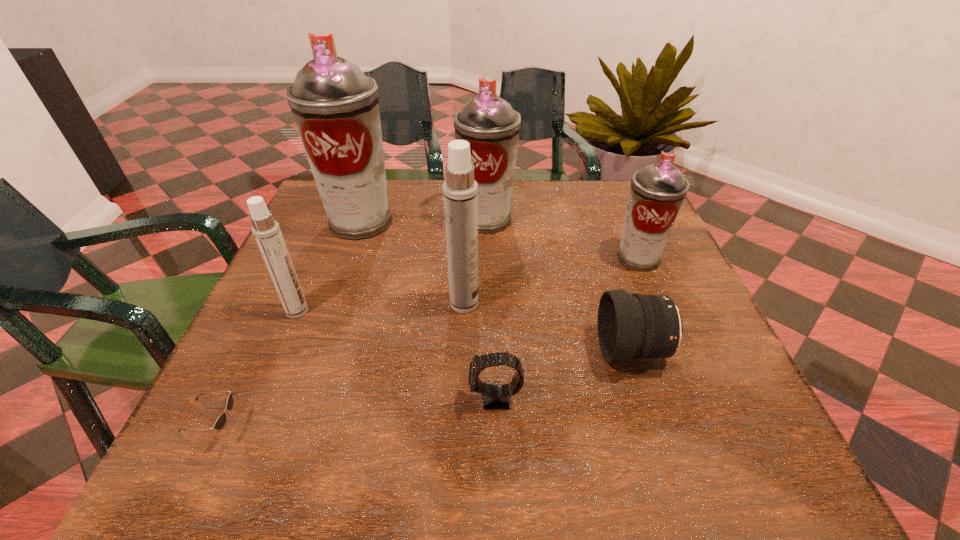
I want to click on gray watch, so click(496, 397).

Locate an element on the screen. The height and width of the screenshot is (540, 960). black sunglasses is located at coordinates (220, 422).

Image resolution: width=960 pixels, height=540 pixels. Identify the location of sunglasses. (220, 422).

Where is `free region located on the right of the biggest gray aerosol can`? This screenshot has height=540, width=960. free region located on the right of the biggest gray aerosol can is located at coordinates (488, 221).

Where is `vacant space located on the right of the second smallest gray aerosol can`? The height and width of the screenshot is (540, 960). vacant space located on the right of the second smallest gray aerosol can is located at coordinates (612, 219).

The height and width of the screenshot is (540, 960). I want to click on free space located 0.110m on the left of the right white aerosol can, so click(x=398, y=303).

Where is `free space located on the front of the smallest gray aerosol can`? The height and width of the screenshot is (540, 960). free space located on the front of the smallest gray aerosol can is located at coordinates (704, 415).

At what (x,y) coordinates should I click in order to perform the action: click on vacant position located 0.340m on the right of the smaller white aerosol can. Please return your answer as a coordinate pair (x, y). Looking at the image, I should click on (471, 311).

At what (x,y) coordinates should I click in order to perform the action: click on free space located 0.110m at the front element of the black telephoto lens. Please return your answer as a coordinate pair (x, y). Image resolution: width=960 pixels, height=540 pixels. Looking at the image, I should click on (542, 350).

Locate an element on the screen. This screenshot has width=960, height=540. free space located at the front element of the black telephoto lens is located at coordinates (422, 350).